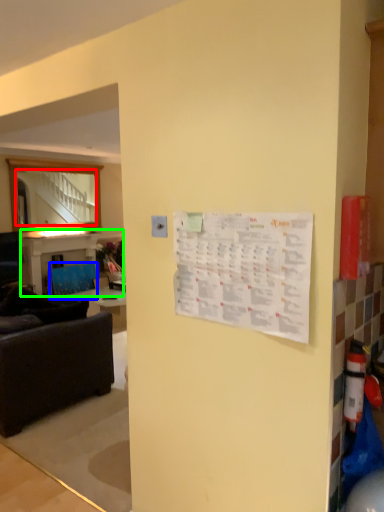
Question: Based on their relative distances, which object is farther from mirror (highlighted by a red box)? Choose from armchair (highlighted by a blue box) and table (highlighted by a green box).

Choices:
 (A) armchair
 (B) table

Answer: (A)